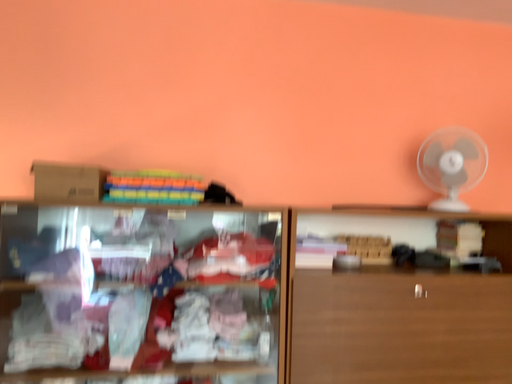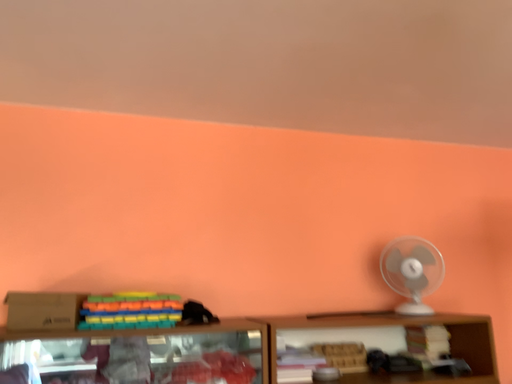
Question: Which way did the camera rotate in the video?

Choices:
 (A) rotated downward
 (B) rotated upward

Answer: (B)